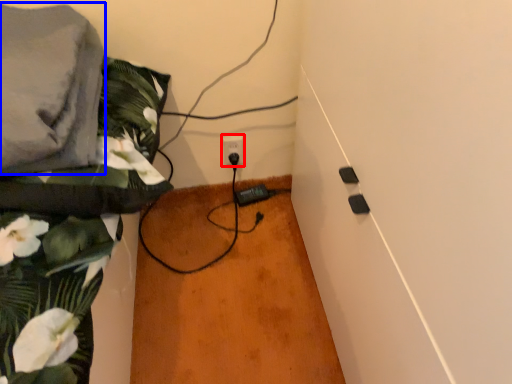
Question: Among these objects, which one is farthest to the camera, power plugs and sockets (highlighted by a red box) or linen (highlighted by a blue box)?

Choices:
 (A) power plugs and sockets
 (B) linen

Answer: (A)